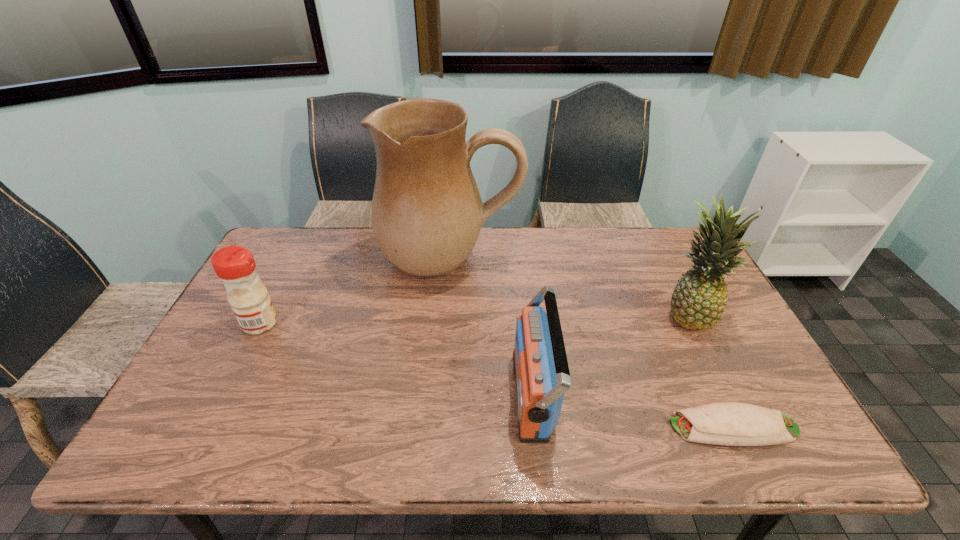
Where is `the tallest object`? Image resolution: width=960 pixels, height=540 pixels. the tallest object is located at coordinates (426, 214).

I want to click on cream pitcher, so 426,214.

Identify the location of the second tallest object. (698, 301).

The width and height of the screenshot is (960, 540). In order to click on the leftmost object in this screenshot , I will do `click(234, 265)`.

Find the location of a particular element. The width and height of the screenshot is (960, 540). radio receiver is located at coordinates (541, 370).

Identify the location of burrito. (728, 423).

The height and width of the screenshot is (540, 960). In order to click on free region located 0.290m at the spout of the farthest object in this screenshot , I will do `click(442, 371)`.

The height and width of the screenshot is (540, 960). I want to click on vacant region located on the right of the pineapple, so click(x=733, y=315).

The height and width of the screenshot is (540, 960). I want to click on free space located on the right of the leftmost object, so click(x=352, y=323).

Locate an element on the screen. The height and width of the screenshot is (540, 960). free space located on the front-facing side of the radio receiver is located at coordinates (365, 394).